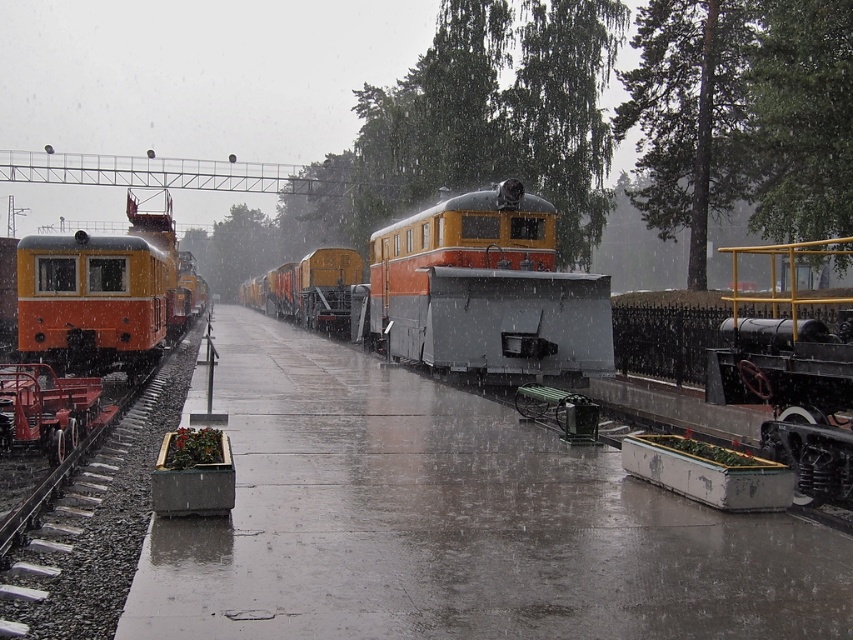
Between orange matte train at center and orange matte train at left, which one appears on the left side from the viewer's perspective?

From the viewer's perspective, orange matte train at left appears more on the left side.

Is orange matte train at center smaller than orange matte train at left?

No, orange matte train at center is not smaller than orange matte train at left.

The width and height of the screenshot is (853, 640). What do you see at coordinates (461, 292) in the screenshot?
I see `orange matte train at center` at bounding box center [461, 292].

The width and height of the screenshot is (853, 640). In order to click on orange matte train at center in this screenshot , I will do `click(461, 292)`.